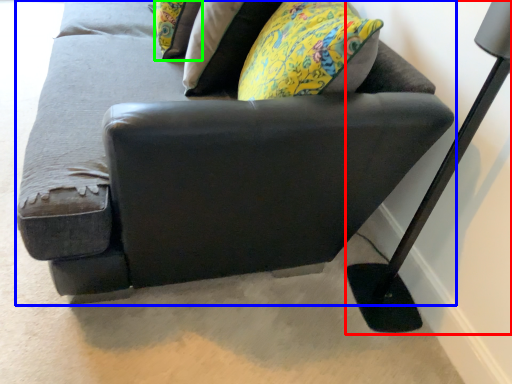
Question: Estimate the real-world distances between objects in this image. Which object is closer to table lamp (highlighted by a red box), studio couch (highlighted by a blue box) or pillow (highlighted by a green box)?

Choices:
 (A) studio couch
 (B) pillow

Answer: (A)